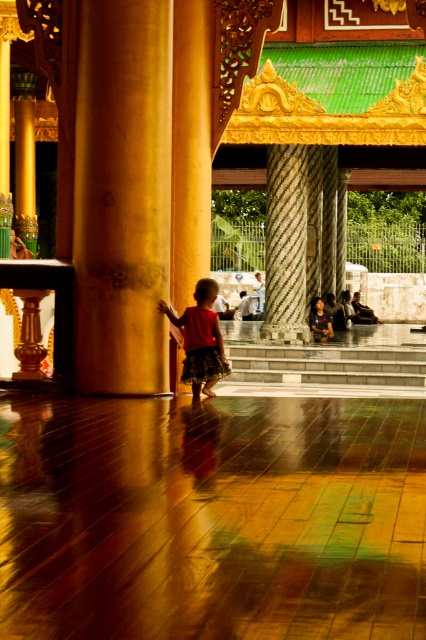
You are a photographer standing in front of the golden pillars. You notice two red items at the center of the scene. Which one is closer to you, the matte red dress at center or the red cotton skirt at center?

The matte red dress at center is closer to you because the red cotton skirt at center is behind it.